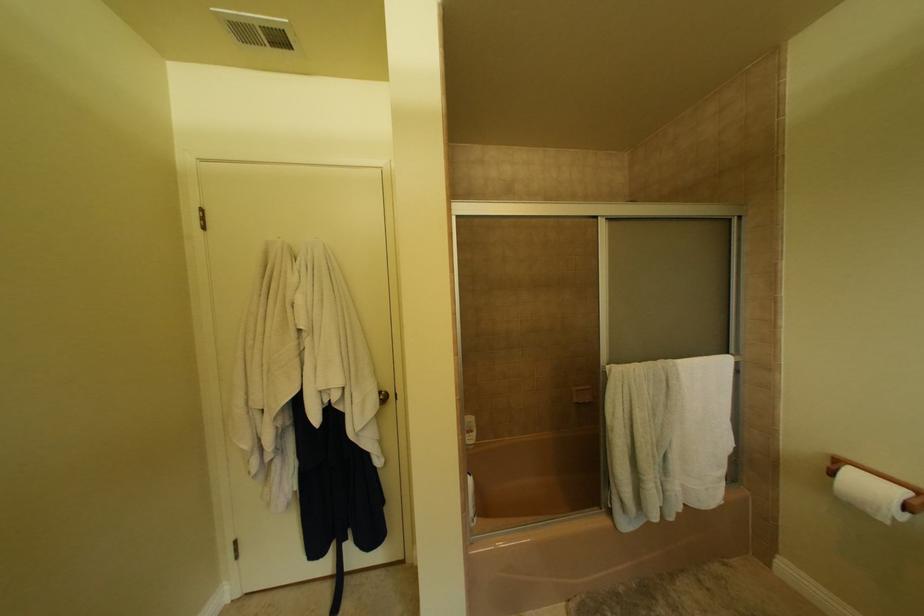
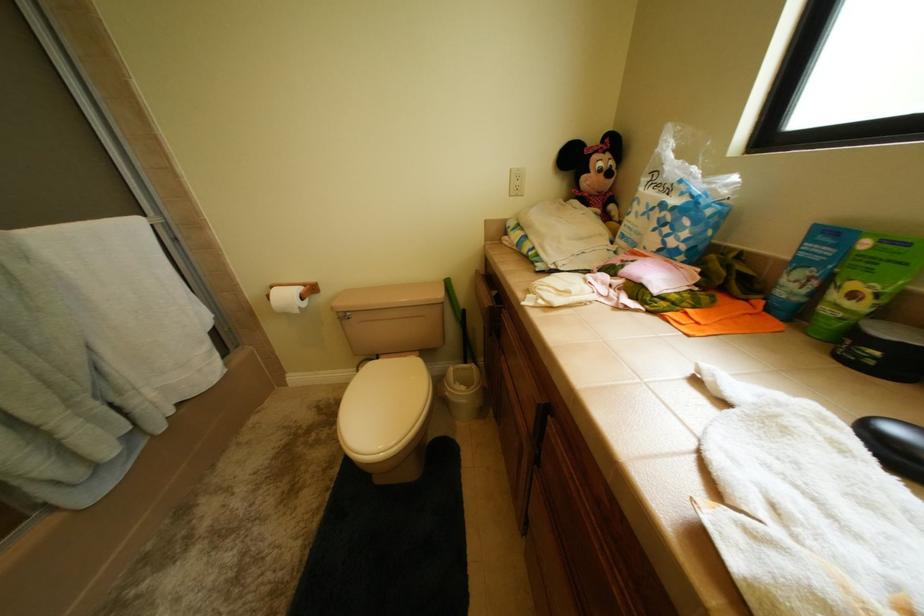
Based on the continuous images, in which direction is the camera rotating?

The rotation direction of the camera is right-down.